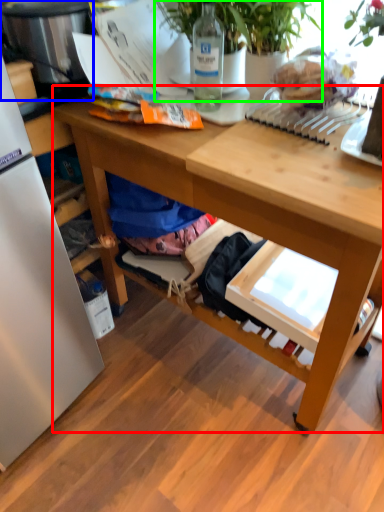
Question: Estimate the real-world distances between objects in this image. Which object is closer to desk (highlighted by a red box), appliance (highlighted by a blue box) or houseplant (highlighted by a green box)?

Choices:
 (A) appliance
 (B) houseplant

Answer: (B)